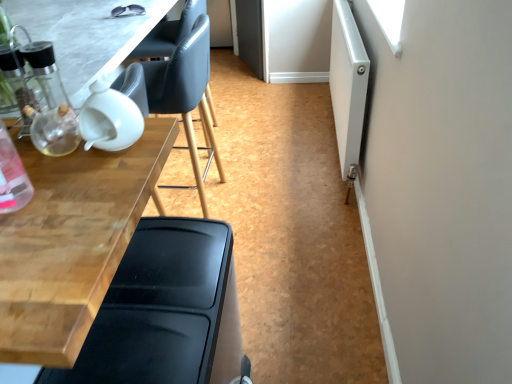
The width and height of the screenshot is (512, 384). I want to click on vacant space in front of white matte screen door at right, so click(x=304, y=214).